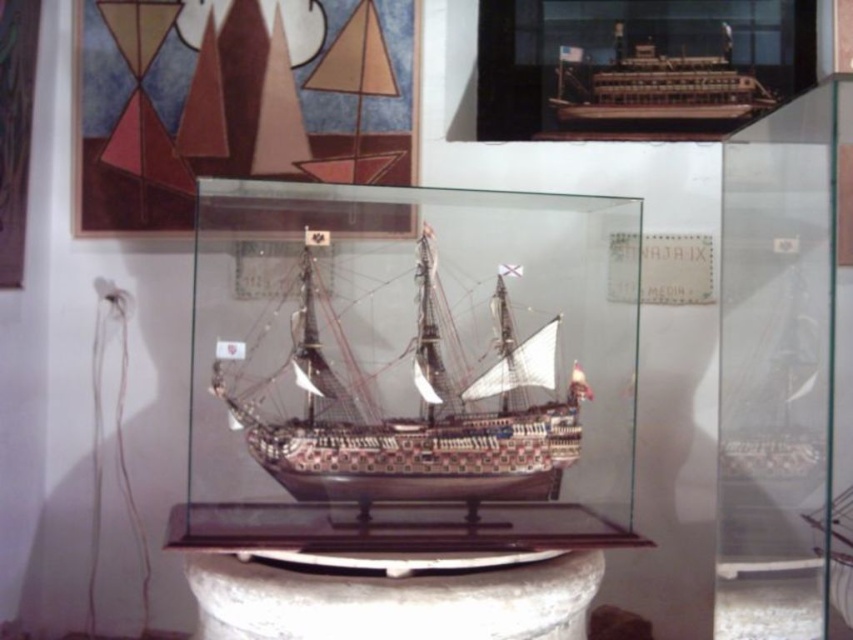
Does point (503, 355) lie behind point (753, 88)?

That is False.

You are a GUI agent. You are given a task and a screenshot of the screen. Output one action in this format:
    pyautogui.click(x=<x>, y=<y>)
    Task: Click on the wooden ship at center
    
    Given the screenshot: What is the action you would take?
    pyautogui.click(x=418, y=410)

Locate an element on the screen. This screenshot has height=640, width=853. wooden ship at center is located at coordinates (418, 410).